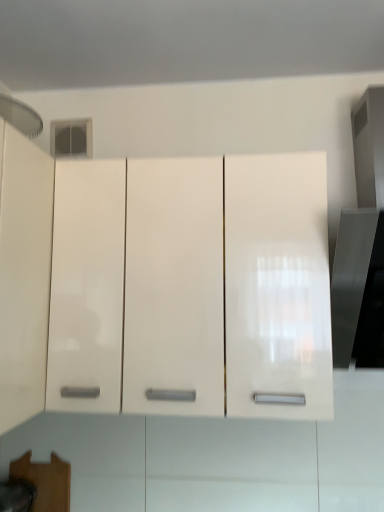
The width and height of the screenshot is (384, 512). What do you see at coordinates (21, 116) in the screenshot?
I see `brushed metal exhaust hood at upper left` at bounding box center [21, 116].

Identify the location of brushed metal exhaust hood at upper left. (21, 116).

Where is `glossy white cabinet at center`? glossy white cabinet at center is located at coordinates (228, 287).

What do you see at coordinates (228, 287) in the screenshot? I see `glossy white cabinet at center` at bounding box center [228, 287].

Where is `brushed metal exhaust hood at upper left`? This screenshot has width=384, height=512. brushed metal exhaust hood at upper left is located at coordinates (21, 116).

Which object is positioned more to the right, glossy white cabinet at center or brushed metal exhaust hood at upper left?

Positioned to the right is glossy white cabinet at center.

Between glossy white cabinet at center and brushed metal exhaust hood at upper left, which one is positioned behind?

→ glossy white cabinet at center is further away from the camera.

Is point (221, 356) more distant than point (21, 132)?

That is False.

From the image's perspective, which object appears higher, glossy white cabinet at center or brushed metal exhaust hood at upper left?

From the image's view, brushed metal exhaust hood at upper left is above.

From a real-world perspective, which is physically below, glossy white cabinet at center or brushed metal exhaust hood at upper left?

From a 3D spatial view, glossy white cabinet at center is below.

Is glossy white cabinet at center thinner than brushed metal exhaust hood at upper left?

No.

In terms of height, does glossy white cabinet at center look taller or shorter compared to brushed metal exhaust hood at upper left?

Considering their sizes, glossy white cabinet at center has more height than brushed metal exhaust hood at upper left.

Between glossy white cabinet at center and brushed metal exhaust hood at upper left, which one has larger size?

With larger size is glossy white cabinet at center.

Do you think glossy white cabinet at center is within brushed metal exhaust hood at upper left, or outside of it?

glossy white cabinet at center is outside brushed metal exhaust hood at upper left.

Is glossy white cabinet at center far from brushed metal exhaust hood at upper left?

They are positioned close to each other.

In the scene shown: Is glossy white cabinet at center facing away from brushed metal exhaust hood at upper left?

No, glossy white cabinet at center is not facing the opposite direction of brushed metal exhaust hood at upper left.

How many degrees apart are the facing directions of glossy white cabinet at center and brushed metal exhaust hood at upper left?

85.9 degrees separate the facing orientations of glossy white cabinet at center and brushed metal exhaust hood at upper left.

The image size is (384, 512). I want to click on exhaust hood in front of the glossy white cabinet at center, so click(x=21, y=116).

Can you confirm if brushed metal exhaust hood at upper left is positioned to the left of glossy white cabinet at center?

Yes.

Is brushed metal exhaust hood at upper left in front of or behind glossy white cabinet at center in the image?

Clearly, brushed metal exhaust hood at upper left is in front of glossy white cabinet at center.

Is point (13, 115) closer or farther from the camera than point (286, 395)?

Point (13, 115) is farther from the camera than point (286, 395).

From the image's perspective, is brushed metal exhaust hood at upper left below glossy white cabinet at center?

No, from the image's perspective, brushed metal exhaust hood at upper left is not beneath glossy white cabinet at center.

From a real-world perspective, is brushed metal exhaust hood at upper left positioned under glossy white cabinet at center based on gravity?

No, from a real-world perspective, brushed metal exhaust hood at upper left is not below glossy white cabinet at center.

Considering the sizes of brushed metal exhaust hood at upper left and glossy white cabinet at center in the image, is brushed metal exhaust hood at upper left wider or thinner than glossy white cabinet at center?

In the image, brushed metal exhaust hood at upper left appears to be more narrow than glossy white cabinet at center.

Is brushed metal exhaust hood at upper left taller than glossy white cabinet at center?

No, brushed metal exhaust hood at upper left is not taller than glossy white cabinet at center.

Does brushed metal exhaust hood at upper left have a larger size compared to glossy white cabinet at center?

Incorrect, brushed metal exhaust hood at upper left is not larger than glossy white cabinet at center.

Is brushed metal exhaust hood at upper left surrounding glossy white cabinet at center?

No, glossy white cabinet at center is not a part of brushed metal exhaust hood at upper left.

Is brushed metal exhaust hood at upper left far from glossy white cabinet at center?

No, brushed metal exhaust hood at upper left is in close proximity to glossy white cabinet at center.

Is brushed metal exhaust hood at upper left facing towards glossy white cabinet at center?

No, brushed metal exhaust hood at upper left is not turned towards glossy white cabinet at center.

The width and height of the screenshot is (384, 512). Identify the location of cabinetry behind the brushed metal exhaust hood at upper left. (228, 287).

I want to click on exhaust hood that appears above the glossy white cabinet at center (from the image's perspective), so click(x=21, y=116).

Where is `exhaust hood above the glossy white cabinet at center (from a real-world perspective)`? The height and width of the screenshot is (512, 384). exhaust hood above the glossy white cabinet at center (from a real-world perspective) is located at coordinates (21, 116).